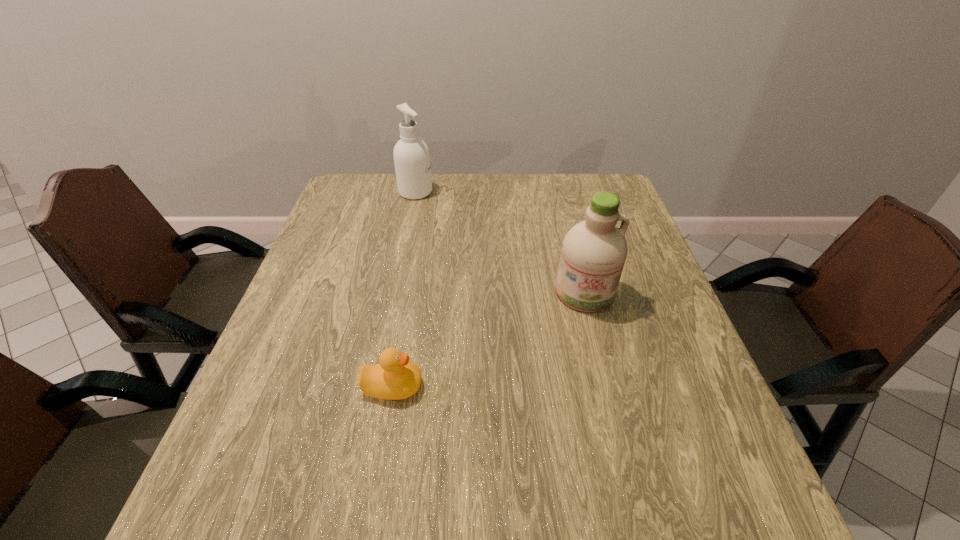
Where is `free space that satisfies the following two spatial constraints: 1. on the front label of the second nearest object; 2. on the face of the nearest object`? This screenshot has height=540, width=960. free space that satisfies the following two spatial constraints: 1. on the front label of the second nearest object; 2. on the face of the nearest object is located at coordinates (608, 386).

Where is `blank space that satisfies the following two spatial constraints: 1. on the front label of the second nearest object; 2. on the face of the nearest object`? blank space that satisfies the following two spatial constraints: 1. on the front label of the second nearest object; 2. on the face of the nearest object is located at coordinates (608, 386).